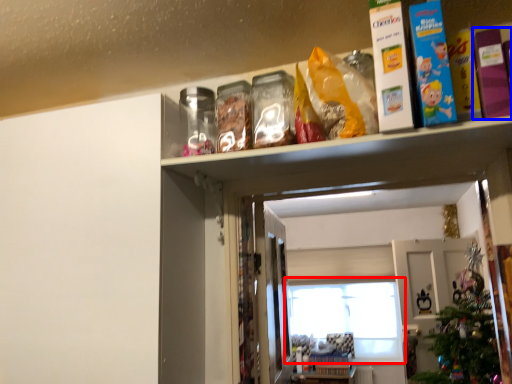
Question: Among these objects, which one is farthest to the camera, window (highlighted by a red box) or book (highlighted by a blue box)?

Choices:
 (A) window
 (B) book

Answer: (A)